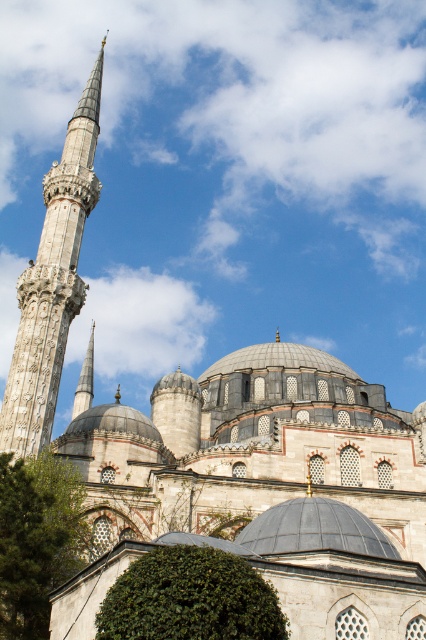
Question: Is gray stone minaret at left closer to the viewer compared to polished silver spire at left?

Choices:
 (A) yes
 (B) no

Answer: (A)

Question: Is gray stone minaret at left smaller than polished silver spire at left?

Choices:
 (A) yes
 (B) no

Answer: (B)

Question: Considering the relative positions of gray stone minaret at left and polished silver spire at left in the image provided, where is gray stone minaret at left located with respect to polished silver spire at left?

Choices:
 (A) right
 (B) left

Answer: (A)